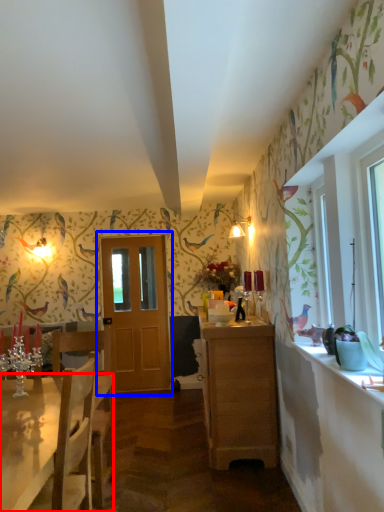
Question: Among these objects, which one is farthest to the camera, desk (highlighted by a red box) or door (highlighted by a blue box)?

Choices:
 (A) desk
 (B) door

Answer: (B)